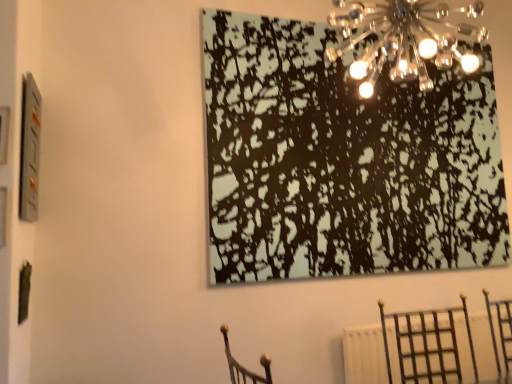
What is the approximate height of metallic silver picture frame at upper left?

metallic silver picture frame at upper left is 24.08 inches in height.

Where is `black textured painting at upper center`? Image resolution: width=512 pixels, height=384 pixels. black textured painting at upper center is located at coordinates (343, 160).

Where is `metallic dark brown chair at lower right`? The height and width of the screenshot is (384, 512). metallic dark brown chair at lower right is located at coordinates (426, 341).

Describe the element at coordinates (426, 341) in the screenshot. Image resolution: width=512 pixels, height=384 pixels. I see `metallic dark brown chair at lower right` at that location.

This screenshot has width=512, height=384. I want to click on metallic silver picture frame at upper left, so click(x=29, y=150).

Does metallic silver picture frame at upper left touch black textured painting at upper center?

No, metallic silver picture frame at upper left is not next to black textured painting at upper center.

From the image's perspective, which one is positioned lower, metallic silver picture frame at upper left or black textured painting at upper center?

metallic silver picture frame at upper left is shown below in the image.

Considering the sizes of objects metallic silver picture frame at upper left and black textured painting at upper center in the image provided, who is thinner, metallic silver picture frame at upper left or black textured painting at upper center?

With smaller width is metallic silver picture frame at upper left.

Can we say metallic dark brown chair at lower right lies outside metallic glass chandelier at upper center?

Yes.

Is point (410, 357) closer to viewer compared to point (468, 24)?

Yes, point (410, 357) is in front of point (468, 24).

Does metallic dark brown chair at lower right have a greater width compared to metallic glass chandelier at upper center?

Yes.

How different are the orientations of metallic dark brown chair at lower right and metallic glass chandelier at upper center in degrees?

They differ by 3.47 degrees in their facing directions.

How far apart are metallic silver picture frame at upper left and metallic dark brown chair at lower right?

The distance of metallic silver picture frame at upper left from metallic dark brown chair at lower right is 1.87 meters.

Is point (28, 186) in front of point (407, 356)?

Yes, it is in front of point (407, 356).

Does metallic silver picture frame at upper left turn towards metallic dark brown chair at lower right?

No, metallic silver picture frame at upper left is not oriented towards metallic dark brown chair at lower right.

Can you confirm if metallic silver picture frame at upper left is smaller than metallic dark brown chair at lower right?

Indeed, metallic silver picture frame at upper left has a smaller size compared to metallic dark brown chair at lower right.

Is metallic silver picture frame at upper left touching metallic glass chandelier at upper center?

No, metallic silver picture frame at upper left is not beside metallic glass chandelier at upper center.

Is metallic silver picture frame at upper left oriented away from metallic glass chandelier at upper center?

That's not correct — metallic silver picture frame at upper left is not looking away from metallic glass chandelier at upper center.

Considering the relative positions of metallic silver picture frame at upper left and metallic glass chandelier at upper center in the image provided, is metallic silver picture frame at upper left to the left of metallic glass chandelier at upper center from the viewer's perspective?

Indeed, metallic silver picture frame at upper left is positioned on the left side of metallic glass chandelier at upper center.

From the image's perspective, which is below, metallic silver picture frame at upper left or metallic glass chandelier at upper center?

From the image's view, metallic silver picture frame at upper left is below.

From the image's perspective, between metallic dark brown chair at lower right and black textured painting at upper center, who is located below?

metallic dark brown chair at lower right appears lower in the image.

The width and height of the screenshot is (512, 384). In order to click on tree behind the metallic dark brown chair at lower right in this screenshot , I will do `click(343, 160)`.

Is metallic dark brown chair at lower right at the right side of black textured painting at upper center?

Yes, metallic dark brown chair at lower right is to the right of black textured painting at upper center.

Is metallic dark brown chair at lower right not close to black textured painting at upper center?

No, there isn't a large distance between metallic dark brown chair at lower right and black textured painting at upper center.

How much distance is there between metallic glass chandelier at upper center and black textured painting at upper center?

metallic glass chandelier at upper center and black textured painting at upper center are 53.15 centimeters apart.

Is metallic glass chandelier at upper center positioned with its back to black textured painting at upper center?

That's right, metallic glass chandelier at upper center is facing away from black textured painting at upper center.

Is metallic glass chandelier at upper center to the left or to the right of black textured painting at upper center in the image?

In the image, metallic glass chandelier at upper center appears on the left side of black textured painting at upper center.

At what (x,y) coordinates should I click in order to perform the action: click on tree behind the metallic glass chandelier at upper center. Please return your answer as a coordinate pair (x, y). This screenshot has height=384, width=512. Looking at the image, I should click on (343, 160).

Which object is closer to the camera, metallic glass chandelier at upper center or metallic dark brown chair at lower right?

metallic glass chandelier at upper center is closer to the camera.

Based on the photo, are metallic glass chandelier at upper center and metallic dark brown chair at lower right making contact?

No, metallic glass chandelier at upper center is not in contact with metallic dark brown chair at lower right.

How different are the orientations of metallic glass chandelier at upper center and metallic dark brown chair at lower right in degrees?

The angle between the facing direction of metallic glass chandelier at upper center and the facing direction of metallic dark brown chair at lower right is 3.47 degrees.

How distant is metallic glass chandelier at upper center from metallic dark brown chair at lower right?

The distance of metallic glass chandelier at upper center from metallic dark brown chair at lower right is 4.79 feet.

Locate an element on the screen. tree that appears above the metallic silver picture frame at upper left (from a real-world perspective) is located at coordinates (343, 160).

This screenshot has width=512, height=384. Find the location of `furniture that is on the right side of metallic glass chandelier at upper center`. furniture that is on the right side of metallic glass chandelier at upper center is located at coordinates (426, 341).

When comparing their distances from metallic glass chandelier at upper center, does metallic silver picture frame at upper left or metallic dark brown chair at lower right seem closer?

metallic dark brown chair at lower right lies closer to metallic glass chandelier at upper center than the other object.

Based on their spatial positions, is metallic dark brown chair at lower right or metallic glass chandelier at upper center further from metallic silver picture frame at upper left?

metallic dark brown chair at lower right.

Estimate the real-world distances between objects in this image. Which object is further from metallic dark brown chair at lower right, metallic silver picture frame at upper left or black textured painting at upper center?

metallic silver picture frame at upper left.

Based on their spatial positions, is metallic glass chandelier at upper center or metallic dark brown chair at lower right closer to metallic silver picture frame at upper left?

The object closer to metallic silver picture frame at upper left is metallic glass chandelier at upper center.

From the image, which object appears to be nearer to black textured painting at upper center, metallic silver picture frame at upper left or metallic glass chandelier at upper center?

metallic glass chandelier at upper center.

Based on their spatial positions, is metallic glass chandelier at upper center or black textured painting at upper center closer to metallic silver picture frame at upper left?

black textured painting at upper center is positioned closer to the anchor metallic silver picture frame at upper left.

Based on their spatial positions, is metallic dark brown chair at lower right or metallic glass chandelier at upper center closer to black textured painting at upper center?

metallic glass chandelier at upper center.

Which object lies further to the anchor point black textured painting at upper center, metallic glass chandelier at upper center or metallic dark brown chair at lower right?

The object further to black textured painting at upper center is metallic dark brown chair at lower right.

Locate an element on the screen. This screenshot has width=512, height=384. tree between metallic silver picture frame at upper left and metallic dark brown chair at lower right is located at coordinates (343, 160).

Where is `tree between metallic glass chandelier at upper center and metallic dark brown chair at lower right from top to bottom`? The height and width of the screenshot is (384, 512). tree between metallic glass chandelier at upper center and metallic dark brown chair at lower right from top to bottom is located at coordinates (343, 160).

Find the location of a particular element. The width and height of the screenshot is (512, 384). lamp between metallic silver picture frame at upper left and metallic dark brown chair at lower right from left to right is located at coordinates (404, 39).

Locate an element on the screen. lamp situated between metallic silver picture frame at upper left and black textured painting at upper center from left to right is located at coordinates (404, 39).